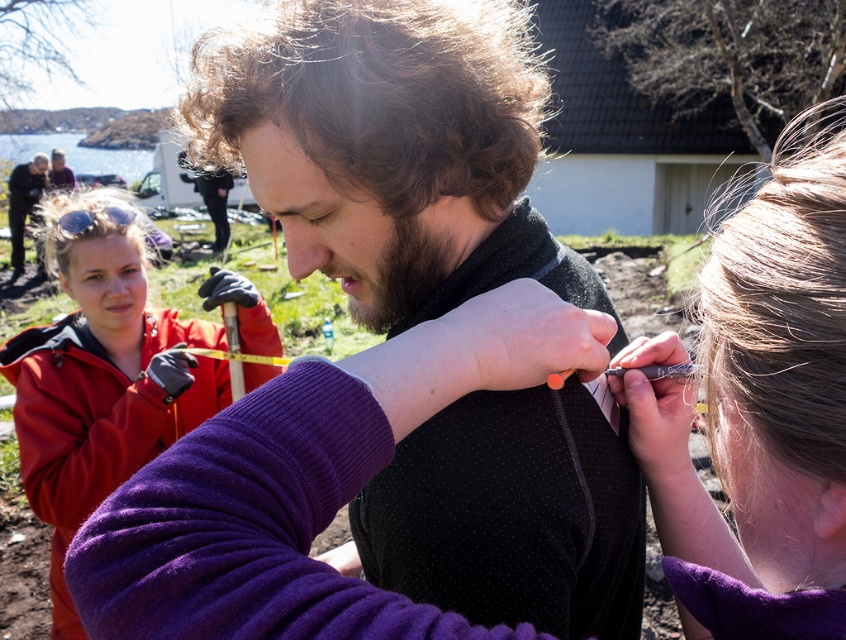
You are standing in the residential area scene and want to know which object is shorter between the black textured sweater at center and the matte black jacket at upper left. Can you tell me?

The black textured sweater at center is shorter than the matte black jacket at upper left according to the description.

You are a photographer trying to capture a portrait of the person in the matte black jacket at upper left and the person with brown curly hair at center. Based on their positions, which subject is positioned lower in the frame?

The brown curly hair at center is located below matte black jacket at upper left, so the person with brown curly hair at center is positioned lower in the frame.